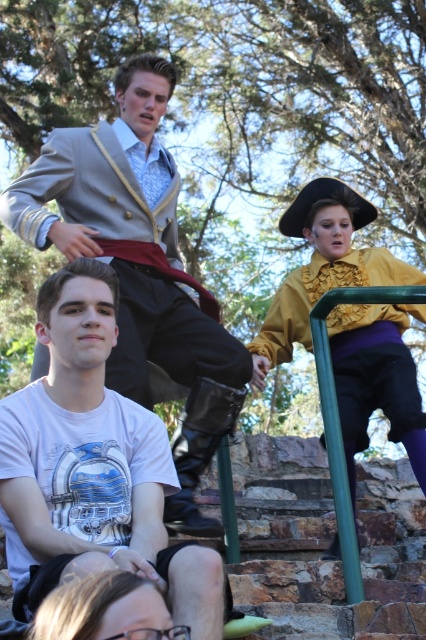
You are a photographer setting up a shoot in the park. You need to place a large tripod between the matte gray suit at upper left and the matte yellow blouse at upper right. Which side of the path between them should you place it to ensure it fits without overlapping either object?

The matte gray suit at upper left is larger in size than the matte yellow blouse at upper right. To ensure the tripod fits without overlapping, place it closer to the smaller matte yellow blouse at upper right side since there might be more space there due to the size difference.

You are standing at the bottom of the stone staircase and want to walk towards the two points marked in the image. Which point, point (14,556) or point (425,310), will you reach first?

Point (14,556) is closer to the viewer than point (425,310), so you will reach point (14,556) first.